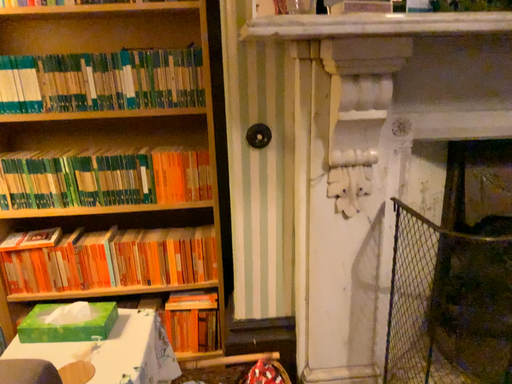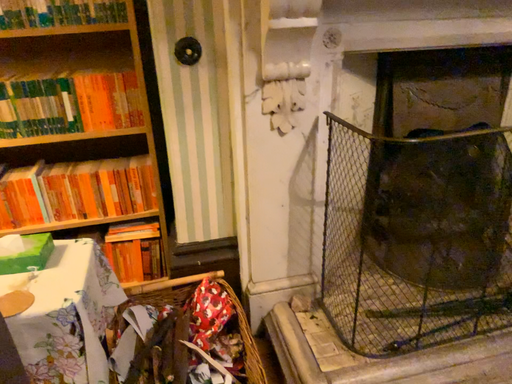
Question: Which way did the camera rotate in the video?

Choices:
 (A) rotated left
 (B) rotated right

Answer: (B)